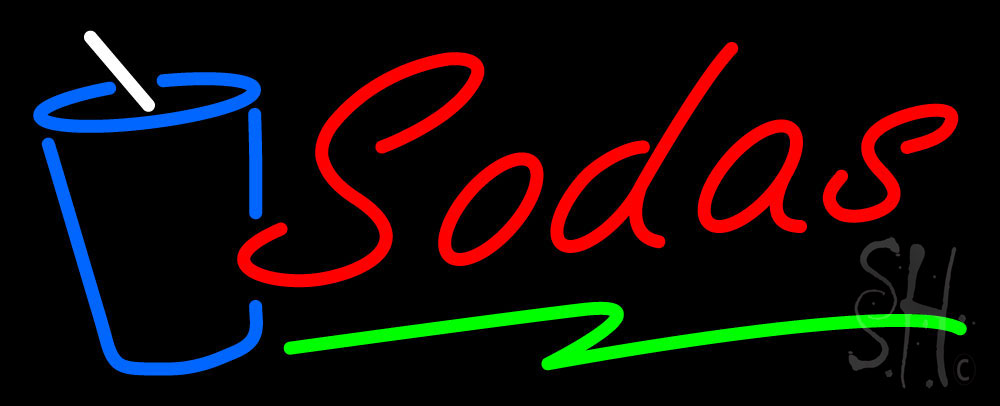
Identify the location of cup. Image resolution: width=1000 pixels, height=406 pixels. (64, 194).